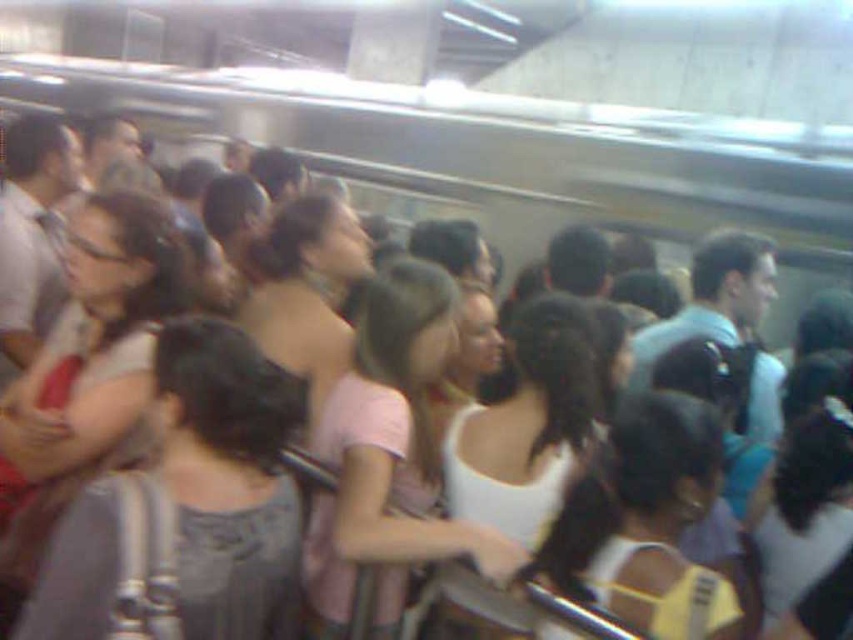
Does pink fabric at center appear on the right side of matte black glasses at left?

Indeed, pink fabric at center is positioned on the right side of matte black glasses at left.

Between pink fabric at center and matte black glasses at left, which one is positioned higher?

matte black glasses at left

Who is more distant from viewer, (442,323) or (177,296)?

Point (177,296)

The height and width of the screenshot is (640, 853). What are the coordinates of `pink fabric at center` in the screenshot? It's located at (389, 454).

Find the location of `pink fabric at center`. pink fabric at center is located at coordinates (x=389, y=454).

Where is `pink fabric at center`? This screenshot has width=853, height=640. pink fabric at center is located at coordinates (389, 454).

Looking at this image, does gray matte shirt at center have a greater height compared to white matte shirt at center?

Correct, gray matte shirt at center is much taller as white matte shirt at center.

Which is more to the left, gray matte shirt at center or white matte shirt at center?

gray matte shirt at center is more to the left.

At what (x,y) coordinates should I click in order to perform the action: click on gray matte shirt at center. Please return your answer as a coordinate pair (x, y). Looking at the image, I should click on (230, 481).